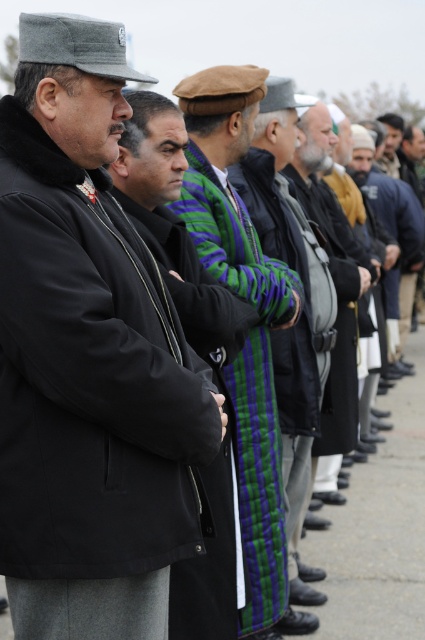
You are attending a formal event and notice two items on the man in the center. Which item is positioned lower on his body between the green striped scarf at center and the striped wool sweater at center?

The green striped scarf at center is located below the striped wool sweater at center, so it is positioned lower on his body.

You are a photographer at an outdoor event and need to capture a photo that includes both the black woolen jacket at left and the striped wool sweater at center. Based on their positions, which direction should you move to ensure both are in frame?

Since the black woolen jacket at left is to the left of the striped wool sweater at center, you should move to the left to ensure both are in frame.

You are a photographer trying to capture a closeup of the green striped scarf at center. The camera you are using has a focal length of 50mm. To ensure the scarf is in focus, where should you position the camera relative to the men in the line?

The green striped scarf at center is located at point coordinates (299,275), so you should position the camera directly facing the center of the men in the line to capture the green striped scarf at center in focus.